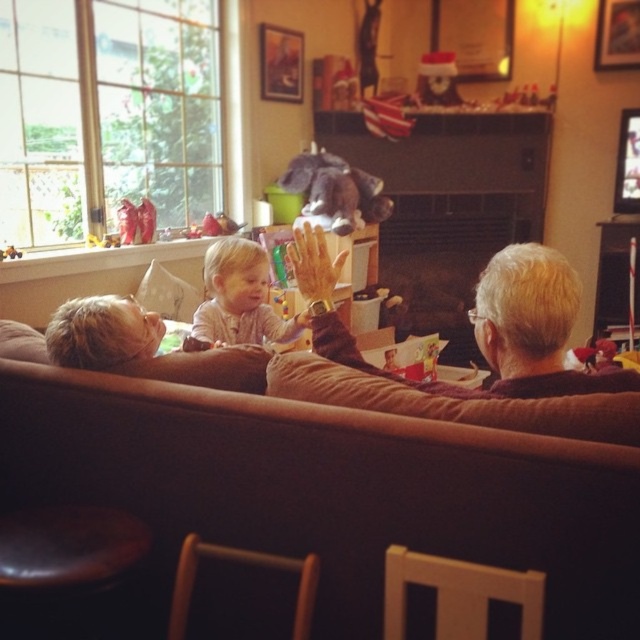
Question: Among these points, which one is nearest to the camera?

Choices:
 (A) (232, 556)
 (B) (161, 330)
 (C) (442, 100)

Answer: (A)

Question: Which object is farther from the camera taking this photo?

Choices:
 (A) matte brown couch at left
 (B) wooden chair at lower center
 (C) brown fabric couch at center

Answer: (A)

Question: From the image, what is the correct spatial relationship of wooden chair at lower center in relation to light pink fabric baby at center?

Choices:
 (A) left
 (B) right

Answer: (B)

Question: Is matte brown couch at left positioned in front of light pink fabric baby at center?

Choices:
 (A) no
 (B) yes

Answer: (B)

Question: Is brown fabric couch at center thinner than wooden chair at lower center?

Choices:
 (A) yes
 (B) no

Answer: (B)

Question: Which of the following is the farthest from the observer?

Choices:
 (A) brown fabric couch at center
 (B) brown leather armchair at lower center
 (C) matte brown couch at left

Answer: (C)